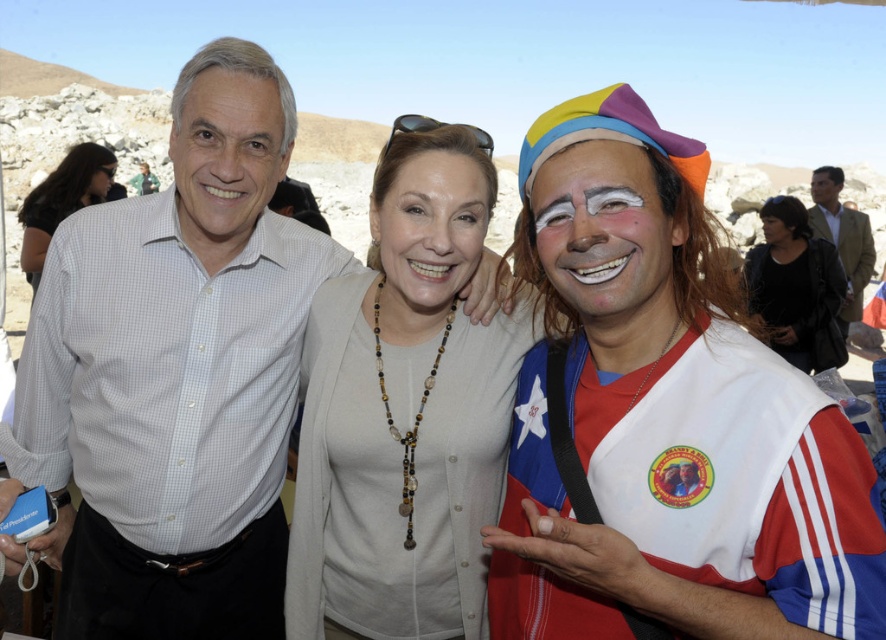
You are a photographer at the event and want to ensure both the black leather jacket at center and the smooth skin face at upper right are in focus. Given that your camera can only focus on objects within a 1.5 meter distance range, can you confirm if both are within the same focal range?

The black leather jacket at center is larger than the smooth skin face at upper right, but size does not indicate distance. Without specific distance information, it is impossible to determine if both are within the 1.5 meter focal range.

You are a photographer standing at the edge of the desert. You see two objects at the center of the image, the white matte face paint at center and the matte white shirt at center. You want to take a photo that includes both objects in the frame. Given that your camera has a maximum focus range of 70 feet, will both objects be in focus?

The white matte face paint at center is 76.68 feet away from matte white shirt at center. Since the distance between them exceeds the camera maximum focus range of 70 feet, the camera cannot focus on both objects simultaneously.

You are a photographer at the event and want to ensure that both the white matte face paint at center and the matte white shirt at center are clearly visible in the photo. Given their positions, which one might be more challenging to capture distinctly?

The white matte face paint at center is in front of the matte white shirt at center, so it might be more challenging to capture the matte white shirt at center distinctly because it is partially obscured by the face paint.